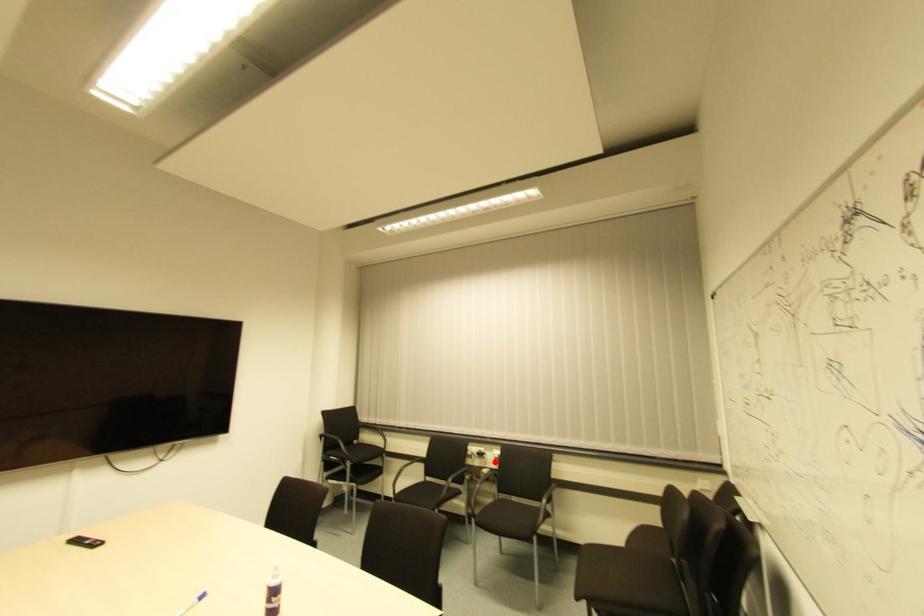
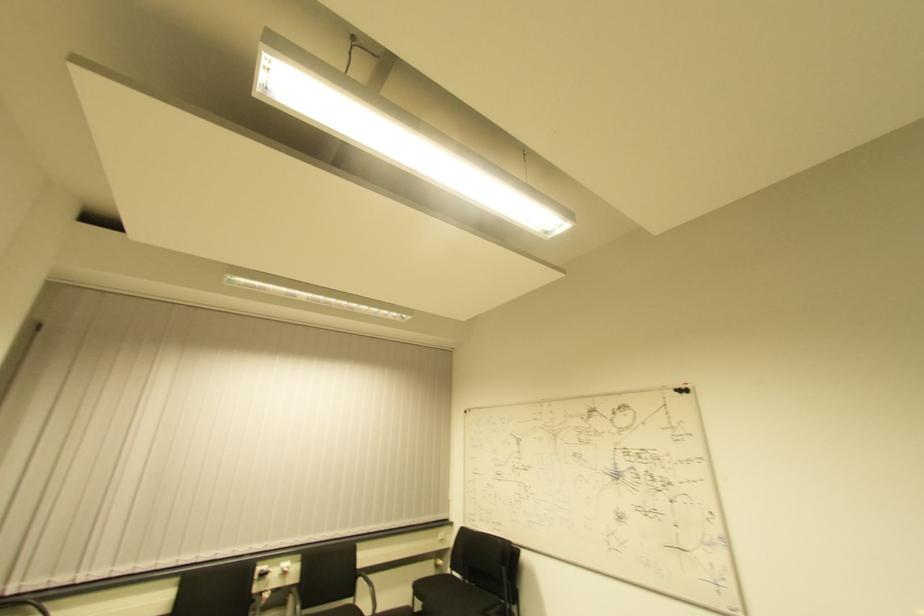
In the second image, find the point that corresponds to the highlighted location in the first image.

(283, 576)